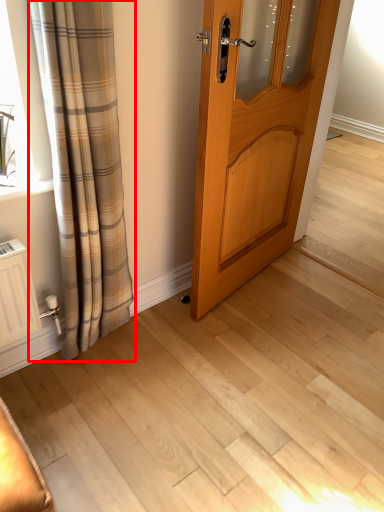
Question: From the image's perspective, what is the correct spatial relationship of curtain (annotated by the red box) in relation to door?

Choices:
 (A) below
 (B) above

Answer: (A)